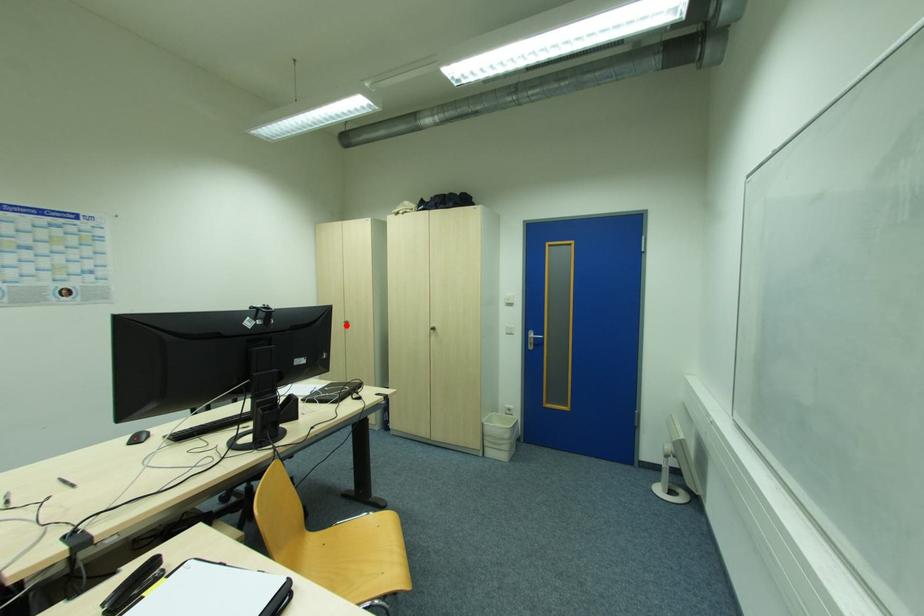
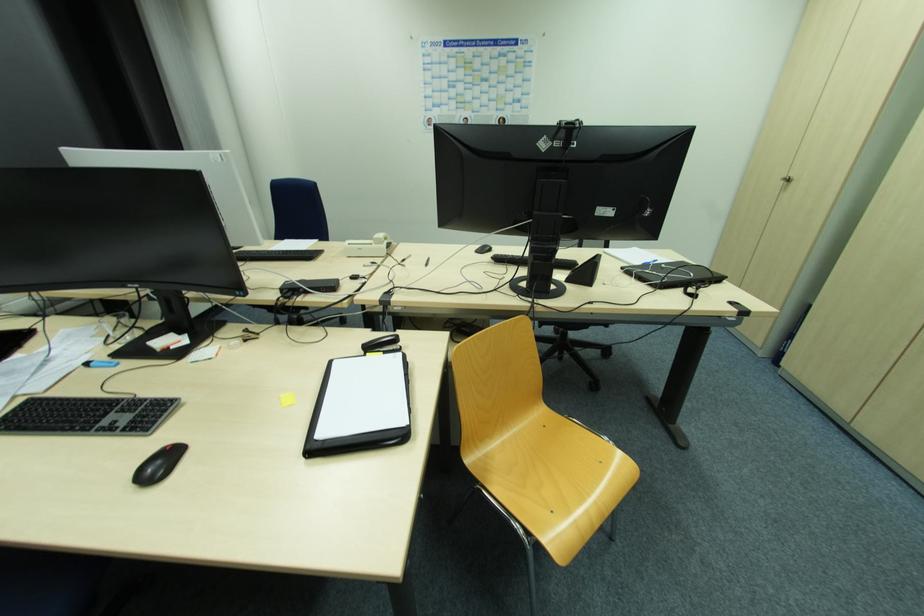
Find the pixel in the second image that matches the highlighted location in the first image.

(784, 183)